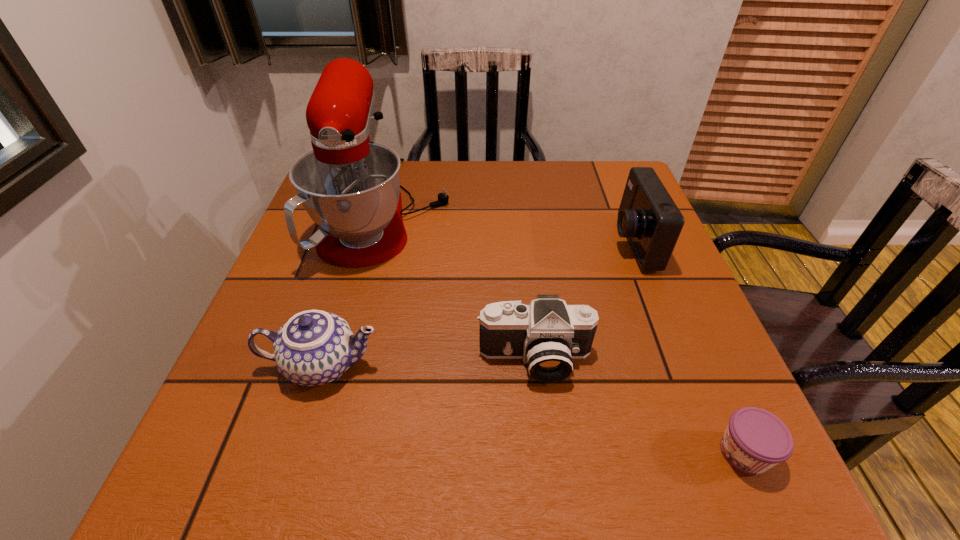
The width and height of the screenshot is (960, 540). In order to click on free point located on the front-facing side of the right camera in this screenshot , I will do `click(459, 243)`.

This screenshot has width=960, height=540. Find the location of `free region located 0.300m on the left of the third object from right to left`. free region located 0.300m on the left of the third object from right to left is located at coordinates (312, 359).

Where is `free spot located from the spout of the chinaware`? free spot located from the spout of the chinaware is located at coordinates coord(511,365).

Identify the location of free space located 0.350m on the front label of the jam. (488, 453).

The height and width of the screenshot is (540, 960). I want to click on free spot located 0.350m on the front label of the jam, so click(x=488, y=453).

This screenshot has height=540, width=960. Find the location of `free spot located on the front label of the jam`. free spot located on the front label of the jam is located at coordinates (514, 453).

The height and width of the screenshot is (540, 960). In order to click on object positioned at the far edge in this screenshot , I will do `click(350, 187)`.

Where is `object present at the near edge`? object present at the near edge is located at coordinates (755, 440).

Image resolution: width=960 pixels, height=540 pixels. Find the location of `mixer located in the left edge section of the desktop`. mixer located in the left edge section of the desktop is located at coordinates (350, 187).

This screenshot has height=540, width=960. I want to click on chinaware at the left edge, so click(x=314, y=347).